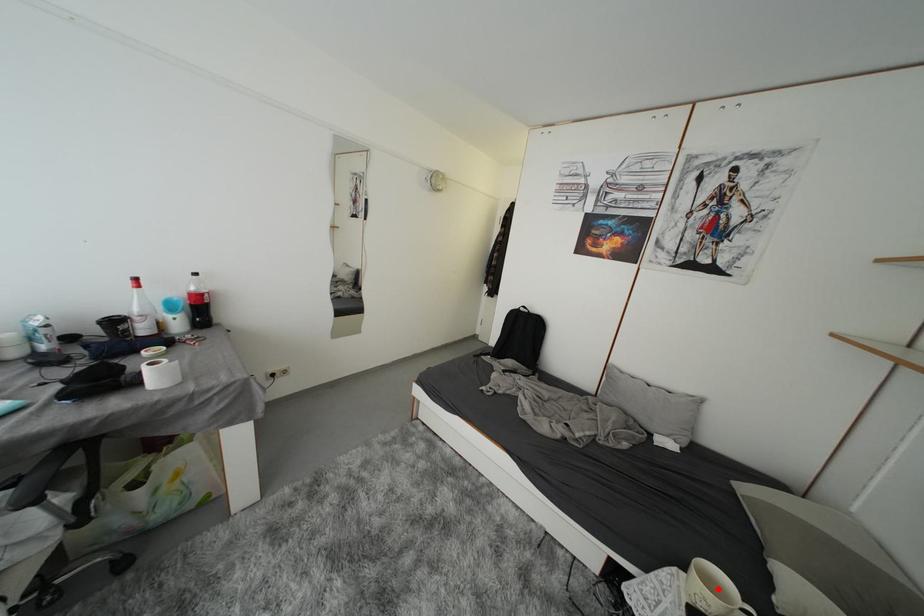
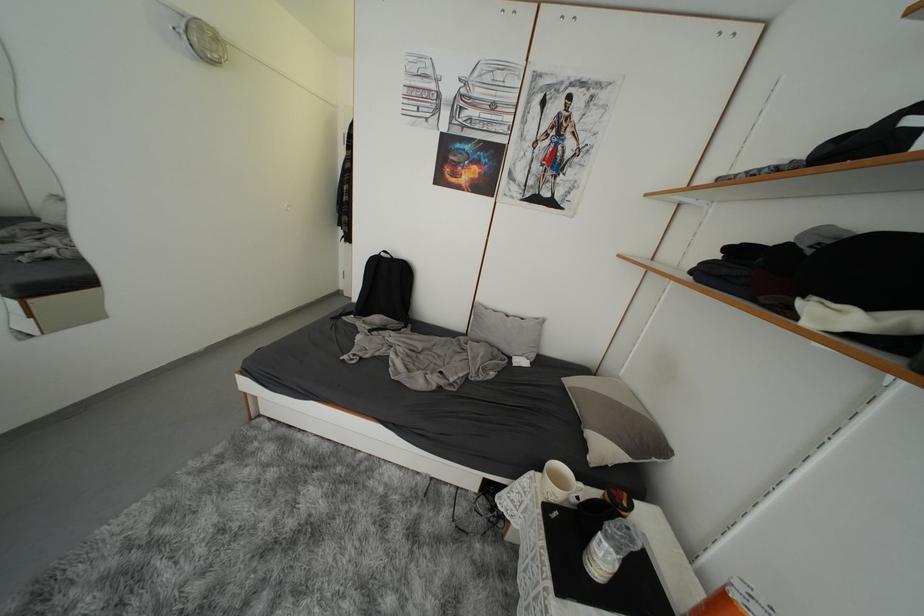
Question: I am providing you with two images of the same scene from different viewpoints. A red point is shown in image1. For the corresponding object point in image2, is it positioned nearer or farther from the camera?

Choices:
 (A) Nearer
 (B) Farther

Answer: (A)